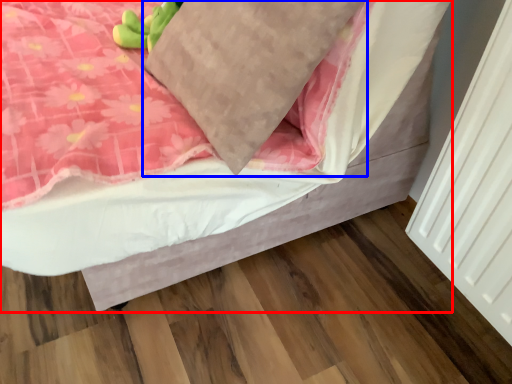
Question: Which object is further to the camera taking this photo, bed (highlighted by a red box) or pillow (highlighted by a blue box)?

Choices:
 (A) bed
 (B) pillow

Answer: (B)